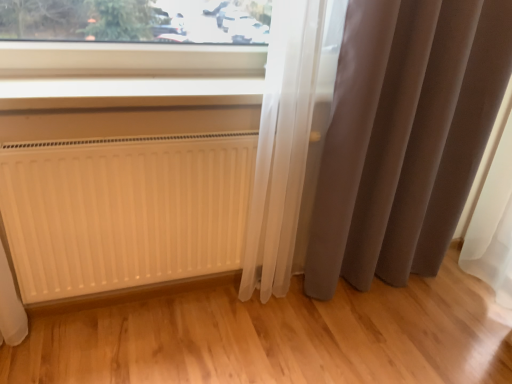
Where is `free spot above white plastic window sill at upper center (from a real-world perspective)`? Image resolution: width=512 pixels, height=384 pixels. free spot above white plastic window sill at upper center (from a real-world perspective) is located at coordinates (146, 83).